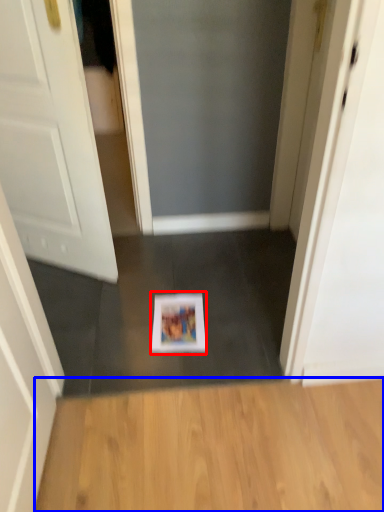
Question: Which object is further to the camera taking this photo, magazine (highlighted by a red box) or hardwood (highlighted by a blue box)?

Choices:
 (A) magazine
 (B) hardwood

Answer: (A)